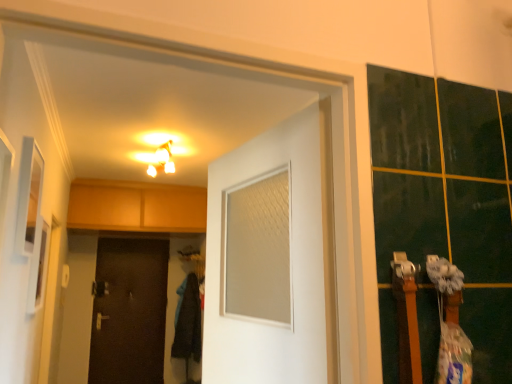
The height and width of the screenshot is (384, 512). Describe the element at coordinates (130, 312) in the screenshot. I see `brown matte door at lower left, the second door viewed from the top` at that location.

Find the location of a particular element. This screenshot has width=512, height=384. white matte door at center, which appears as the 2th door when ordered from the bottom is located at coordinates [x=291, y=261].

Where is `brown matte door at lower left, the second door viewed from the top`? Image resolution: width=512 pixels, height=384 pixels. brown matte door at lower left, the second door viewed from the top is located at coordinates (130, 312).

Considering the positions of objects matte white light fixture at upper center and brown matte door at lower left, the first door viewed from the back, in the image provided, who is in front, matte white light fixture at upper center or brown matte door at lower left, the first door viewed from the back,?

matte white light fixture at upper center is more forward.

Would you say matte white light fixture at upper center is a long distance from brown matte door at lower left, the second door viewed from the top?

Yes, matte white light fixture at upper center and brown matte door at lower left, the second door viewed from the top, are quite far apart.

This screenshot has width=512, height=384. I want to click on door that is the 2nd one below the matte white light fixture at upper center (from a real-world perspective), so [x=130, y=312].

Could you tell me if matte white light fixture at upper center is facing brown matte door at lower left, the 1th door positioned from the bottom?

No.

Does white matte door at center, the second door when ordered from left to right, have a lesser width compared to brown matte door at lower left, the 1th door positioned from the bottom?

No.

From the image's perspective, between white matte door at center, which is the 2th door in back-to-front order, and brown matte door at lower left, the second door viewed from the front, which one is located above?

From the image's view, white matte door at center, which is the 2th door in back-to-front order, is above.

Is white matte door at center, which is counted as the first door, starting from the front, beside brown matte door at lower left, the second door viewed from the front?

white matte door at center, which is counted as the first door, starting from the front, and brown matte door at lower left, the second door viewed from the front, are not in contact.

Between white matte door at center, which is the 2th door in back-to-front order, and brown matte door at lower left, the 1th door positioned from the bottom, which one is positioned in front?

white matte door at center, which is the 2th door in back-to-front order, is in front.

Is white matte door at center, which appears as the 2th door when ordered from the bottom, to the left of matte white light fixture at upper center from the viewer's perspective?

Incorrect, white matte door at center, which appears as the 2th door when ordered from the bottom, is not on the left side of matte white light fixture at upper center.

From the picture: Is white matte door at center, which is the 2th door in back-to-front order, facing towards matte white light fixture at upper center?

No, white matte door at center, which is the 2th door in back-to-front order, is not oriented towards matte white light fixture at upper center.

Does point (293, 201) come farther from viewer compared to point (161, 152)?

No, it is in front of (161, 152).

Does brown matte door at lower left, the 1th door positioned from the bottom, lie behind matte white light fixture at upper center?

That is True.

Considering the relative sizes of brown matte door at lower left, the 1th door positioned from the bottom, and matte white light fixture at upper center in the image provided, is brown matte door at lower left, the 1th door positioned from the bottom, taller than matte white light fixture at upper center?

Yes.

Can we say brown matte door at lower left, the 1th door positioned from the bottom, lies outside matte white light fixture at upper center?

brown matte door at lower left, the 1th door positioned from the bottom, lies outside matte white light fixture at upper center's area.

Is matte white light fixture at upper center directly adjacent to white matte door at center, the first door from the right?

No, matte white light fixture at upper center is not with white matte door at center, the first door from the right.

Considering the sizes of objects matte white light fixture at upper center and white matte door at center, which is the 1th door from top to bottom, in the image provided, who is taller, matte white light fixture at upper center or white matte door at center, which is the 1th door from top to bottom,?

white matte door at center, which is the 1th door from top to bottom.

You are a GUI agent. You are given a task and a screenshot of the screen. Output one action in this format:
    pyautogui.click(x=<x>, y=<y>)
    Task: Click on the light fixture behind the white matte door at center, the second door when ordered from left to right
    
    Given the screenshot: What is the action you would take?
    pyautogui.click(x=162, y=160)

In terms of width, does matte white light fixture at upper center look wider or thinner when compared to white matte door at center, which is counted as the first door, starting from the front?

matte white light fixture at upper center is wider than white matte door at center, which is counted as the first door, starting from the front.

Is white matte door at center, which is the 1th door from top to bottom, at the back of brown matte door at lower left, the second door in the right-to-left sequence?

That's not correct — brown matte door at lower left, the second door in the right-to-left sequence, is not looking away from white matte door at center, which is the 1th door from top to bottom.

Are brown matte door at lower left, the second door viewed from the front, and white matte door at center, which is counted as the first door, starting from the front, beside each other?

No, brown matte door at lower left, the second door viewed from the front, is not beside white matte door at center, which is counted as the first door, starting from the front.

Which object is further away from the camera, brown matte door at lower left, the second door in the right-to-left sequence, or white matte door at center, which is counted as the first door, starting from the front?

Positioned behind is brown matte door at lower left, the second door in the right-to-left sequence.

Could you measure the distance between brown matte door at lower left, the first door from the left, and white matte door at center, the second door when ordered from left to right?

The distance of brown matte door at lower left, the first door from the left, from white matte door at center, the second door when ordered from left to right, is 4.04 meters.

Find the location of a particular element. This screenshot has height=384, width=512. door on the left of matte white light fixture at upper center is located at coordinates (130, 312).

Image resolution: width=512 pixels, height=384 pixels. I want to click on door below the white matte door at center, which is the 1th door from top to bottom (from a real-world perspective), so click(x=130, y=312).

Looking at the image, which one is located closer to matte white light fixture at upper center, white matte door at center, the second door when ordered from left to right, or brown matte door at lower left, the second door in the right-to-left sequence?

Result: brown matte door at lower left, the second door in the right-to-left sequence, is positioned closer to the anchor matte white light fixture at upper center.

Looking at this image, looking at the image, which one is located closer to brown matte door at lower left, the first door from the left, white matte door at center, which is the 2th door in back-to-front order, or matte white light fixture at upper center?

matte white light fixture at upper center.

Looking at the image, which one is located closer to matte white light fixture at upper center, brown matte door at lower left, the second door viewed from the front, or white matte door at center, the second door when ordered from left to right?

Among the two, brown matte door at lower left, the second door viewed from the front, is located nearer to matte white light fixture at upper center.

Estimate the real-world distances between objects in this image. Which object is closer to white matte door at center, which is the 2th door in back-to-front order, brown matte door at lower left, the second door viewed from the top, or matte white light fixture at upper center?

matte white light fixture at upper center lies closer to white matte door at center, which is the 2th door in back-to-front order, than the other object.

Based on their spatial positions, is matte white light fixture at upper center or white matte door at center, which appears as the 2th door when ordered from the bottom, further from brown matte door at lower left, the second door viewed from the top?

Based on the image, white matte door at center, which appears as the 2th door when ordered from the bottom, appears to be further to brown matte door at lower left, the second door viewed from the top.

Considering their positions, is matte white light fixture at upper center positioned closer to white matte door at center, the second door when ordered from left to right, than brown matte door at lower left, the 1th door positioned from the bottom?

Based on the image, matte white light fixture at upper center appears to be nearer to white matte door at center, the second door when ordered from left to right.

What are the coordinates of `light fixture between white matte door at center, which is counted as the first door, starting from the front, and brown matte door at lower left, the first door from the left, in the front-back direction` in the screenshot? It's located at (162, 160).